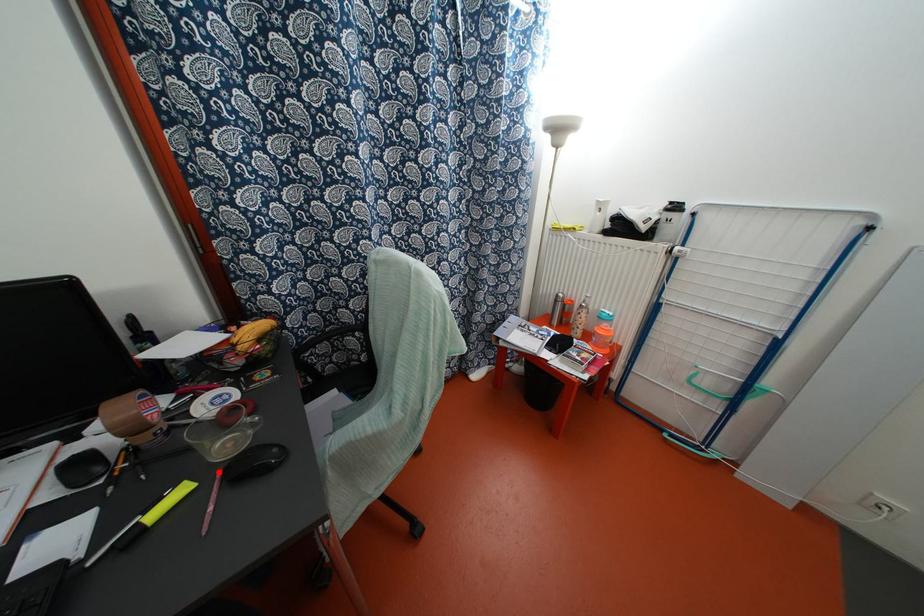
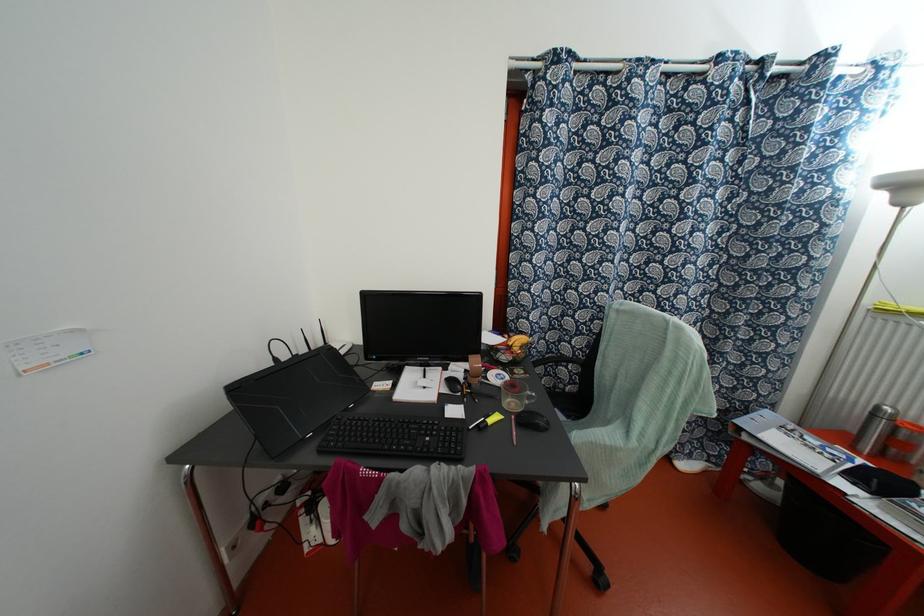
Find the pixel in the second image that matches the highlighted location in the first image.

(513, 416)